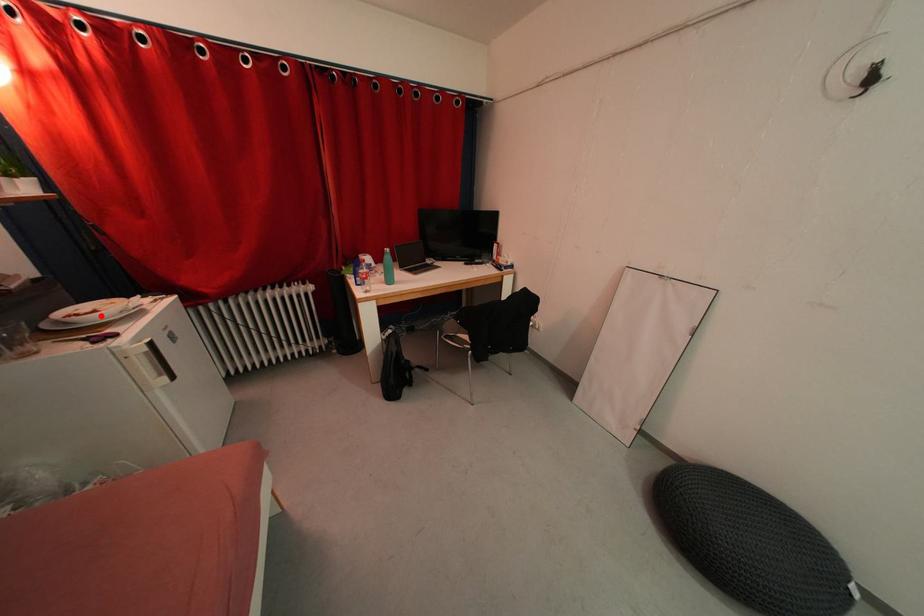
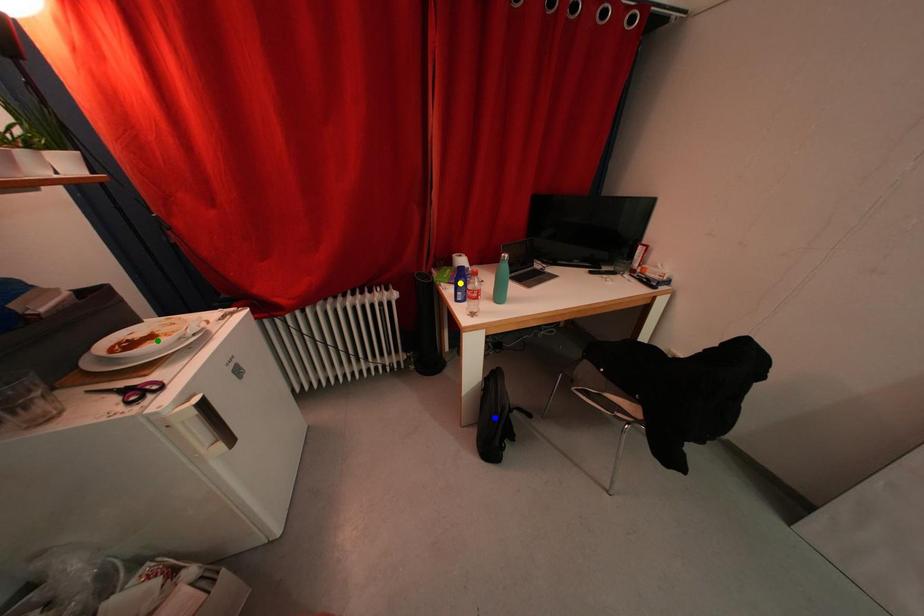
Question: I am providing you with two images of the same scene from different viewpoints. A red point is marked on the first image. You are given multiple points on the second image. Which spot in image 2 lines up with the point in image 1?

Choices:
 (A) yellow point
 (B) blue point
 (C) green point

Answer: (C)